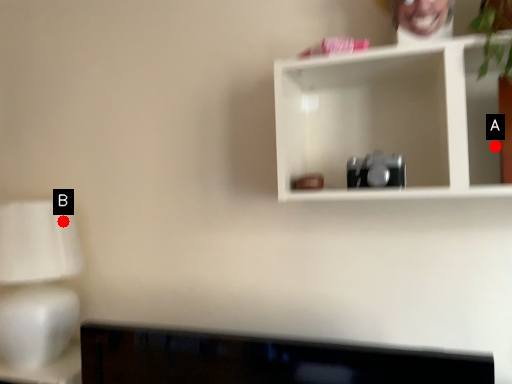
Question: Two points are circled on the image, labeled by A and B beside each circle. Which point appears farthest from the camera in this image?

Choices:
 (A) A is further
 (B) B is further

Answer: (B)